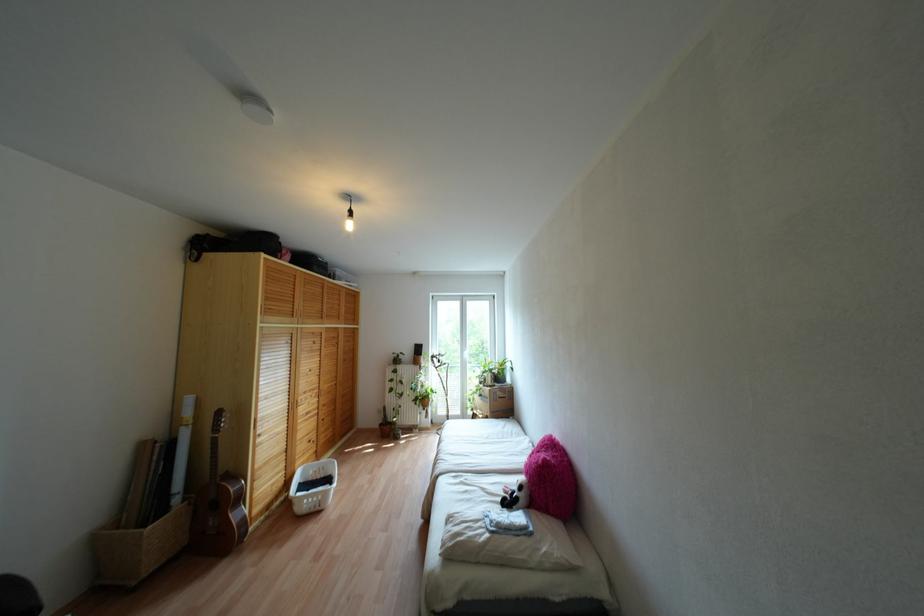
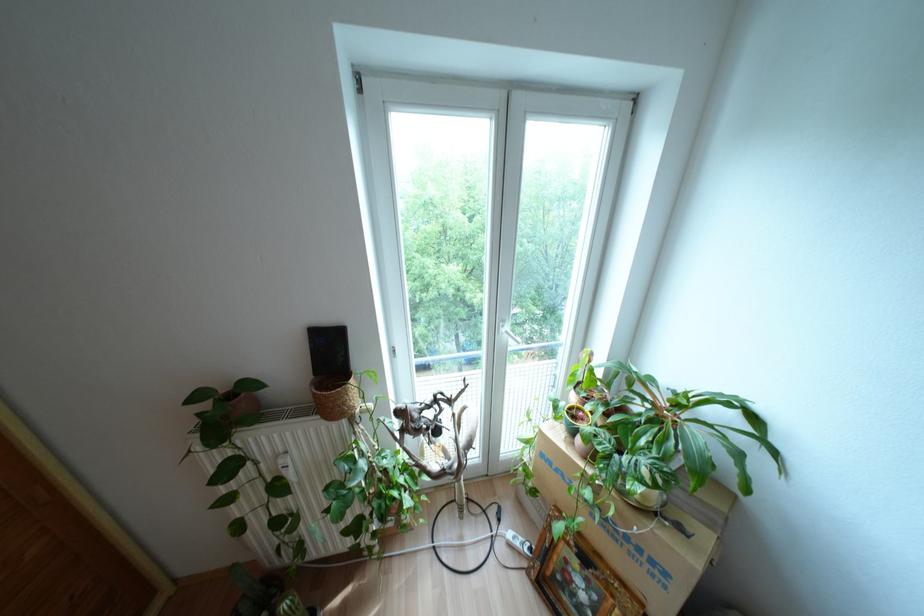
Question: The images are taken continuously from a first-person perspective. In which direction are you moving?

Choices:
 (A) Left
 (B) Right
 (C) Forward
 (D) Backward

Answer: (C)